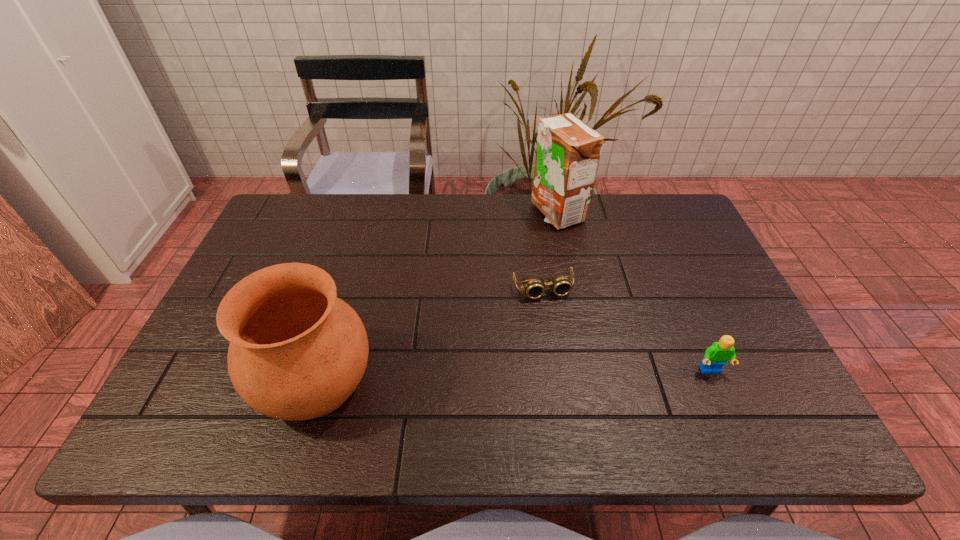
Locate an element on the screen. free space located through the lenses of the second farthest object is located at coordinates (582, 399).

Locate an element on the screen. Image resolution: width=960 pixels, height=540 pixels. vacant space located through the lenses of the second farthest object is located at coordinates (554, 317).

The image size is (960, 540). What are the coordinates of `vacant region located 0.050m through the lenses of the second farthest object` in the screenshot? It's located at (554, 317).

Identify the location of object that is at the far edge. 568,151.

Where is `pottery present at the near edge`? The image size is (960, 540). pottery present at the near edge is located at coordinates pos(297,352).

Identify the location of Lego present at the near edge. 717,355.

I want to click on object present at the right edge, so click(717, 355).

Find the location of a particular element. This screenshot has width=960, height=540. object located at the near right corner is located at coordinates (717, 355).

In the image, there is a desktop. At what (x,y) coordinates should I click in order to perform the action: click on blank space at the far edge. Please return your answer as a coordinate pair (x, y). This screenshot has width=960, height=540. Looking at the image, I should click on click(x=623, y=225).

In the image, there is a desktop. Where is `blank space at the near edge`? This screenshot has height=540, width=960. blank space at the near edge is located at coordinates (512, 371).